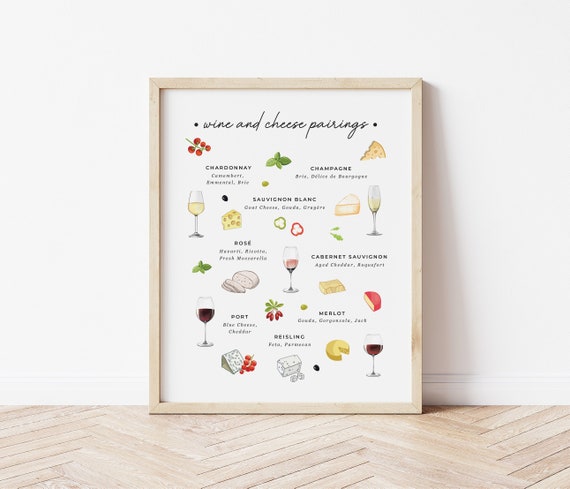
Identify the location of frame. This screenshot has height=489, width=570. (153, 386).